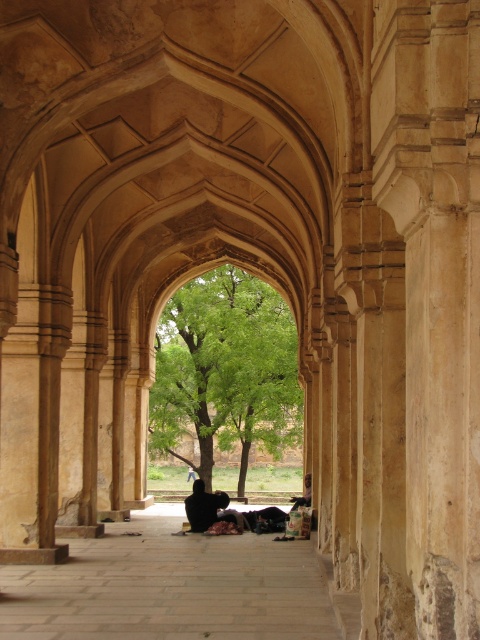
Can you confirm if green leafy tree at center is wider than dark brown fabric at center?

Yes, green leafy tree at center is wider than dark brown fabric at center.

Is point (288, 433) positioned before point (307, 474)?

No, it is behind (307, 474).

Does point (193, 413) come farther from viewer compared to point (307, 477)?

Yes, it is.

Locate an element on the screen. green leafy tree at center is located at coordinates (225, 371).